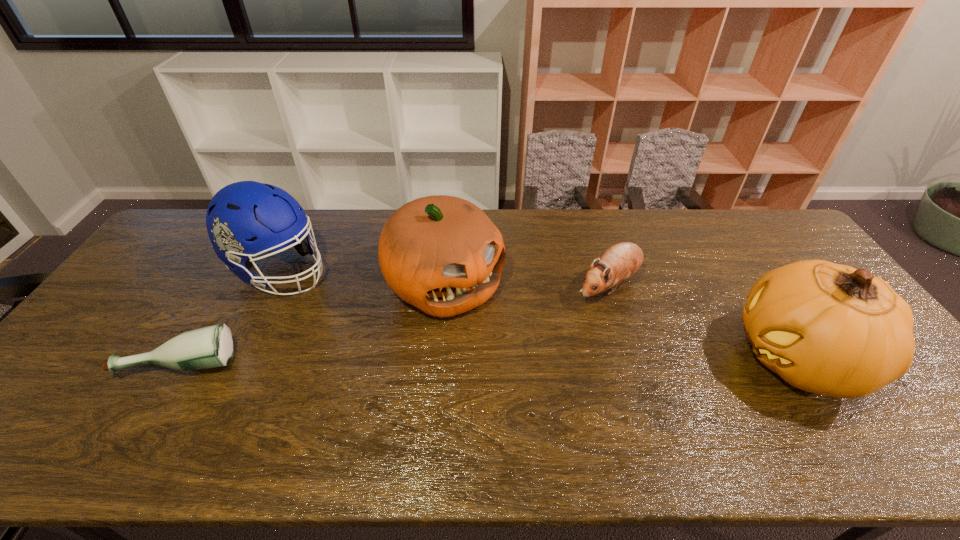
Locate an element on the screen. The height and width of the screenshot is (540, 960). football helmet that is at the far edge is located at coordinates (244, 219).

You are a GUI agent. You are given a task and a screenshot of the screen. Output one action in this format:
    pyautogui.click(x=<x>, y=<y>)
    Task: Click on the object present at the near edge
    Image resolution: width=960 pixels, height=540 pixels.
    Given the screenshot: What is the action you would take?
    pyautogui.click(x=826, y=328)

The image size is (960, 540). I want to click on object situated at the right edge, so click(x=826, y=328).

Locate an element on the screen. This screenshot has height=540, width=960. object at the near right corner is located at coordinates (826, 328).

Locate an element on the screen. The width and height of the screenshot is (960, 540). free region at the far edge of the desktop is located at coordinates (590, 211).

The width and height of the screenshot is (960, 540). In the image, there is a desktop. What are the coordinates of `vacant area at the near edge` in the screenshot? It's located at (479, 413).

Where is `vacant space at the right edge`? Image resolution: width=960 pixels, height=540 pixels. vacant space at the right edge is located at coordinates (764, 253).

I want to click on blank region between the left pumpkin and the rightmost object, so coord(621,321).

You are a GUI agent. You are given a task and a screenshot of the screen. Output one action in this format:
    pyautogui.click(x=<x>, y=<y>)
    Task: Click on the unoccupied area between the shortest object and the left pumpkin
    The width and height of the screenshot is (960, 540).
    Given the screenshot: What is the action you would take?
    pyautogui.click(x=314, y=323)

Image resolution: width=960 pixels, height=540 pixels. What are the coordinates of `empty space that is in between the right pumpkin and the second object from right to left` in the screenshot? It's located at (704, 322).